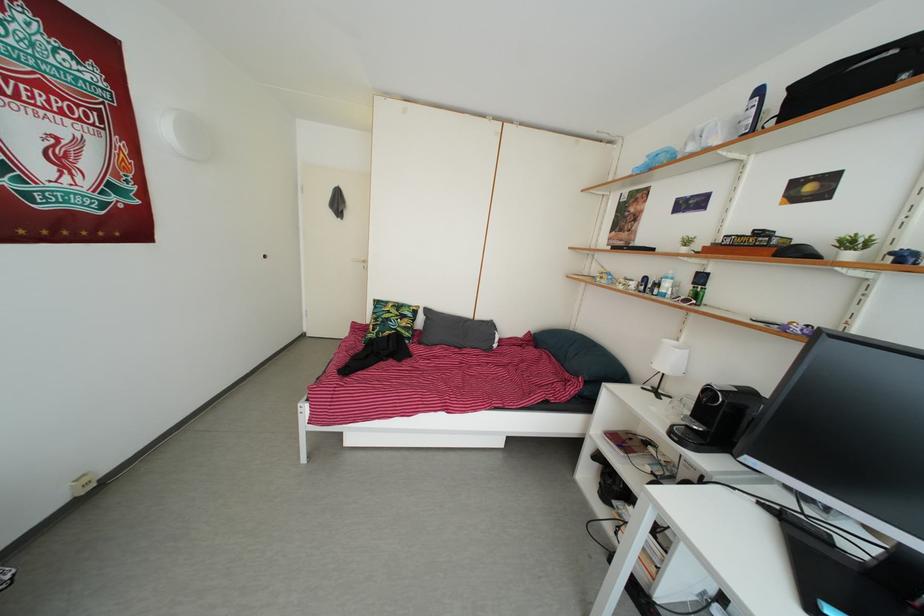
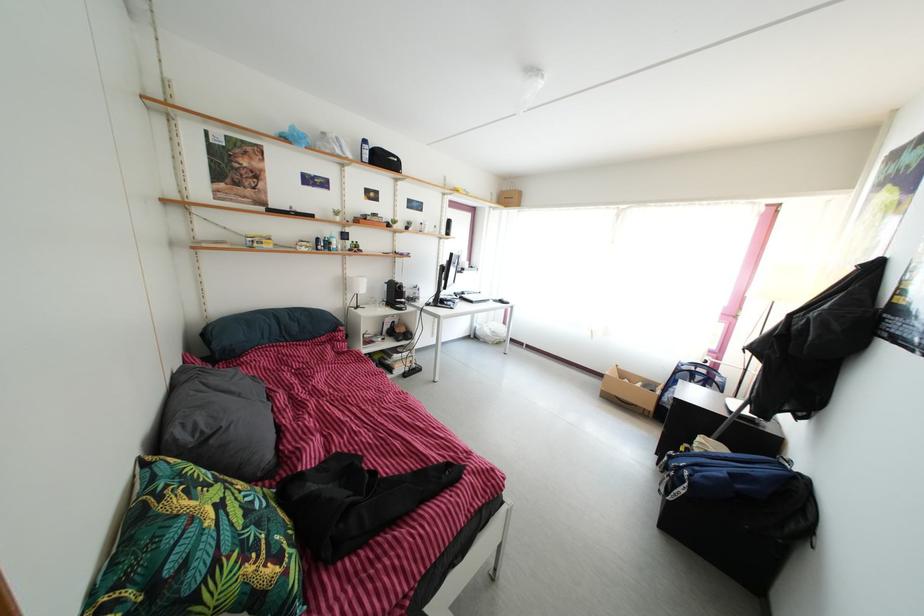
Locate, in the second image, the point that corresponds to the point at 388,330 in the first image.

(264, 533)